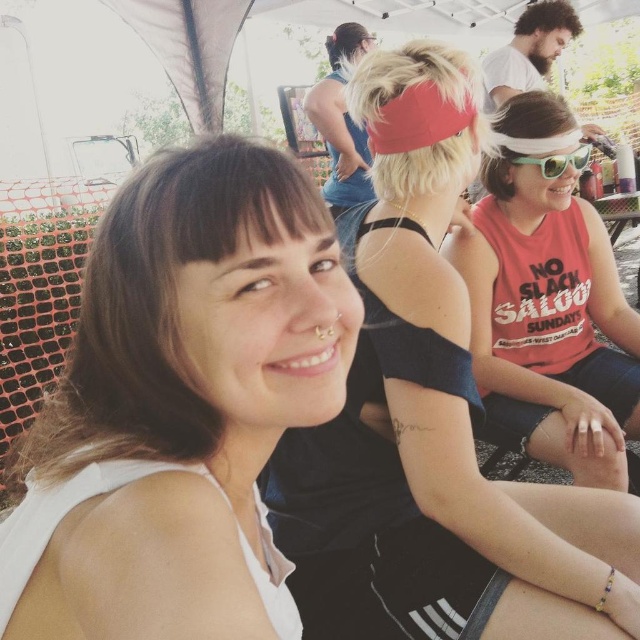
You are a photographer standing 5 feet away from the group. You want to take a photo that includes both the white matte tank top at left and the matte red tank top at center. Can you fit both into your camera frame if your camera has a maximum horizontal field of view of 4 feet?

Answer: The distance between the white matte tank top at left and the matte red tank top at center is 3.49 feet, which is less than the camera frame of 4 feet. Therefore, both can be captured in the same photo.